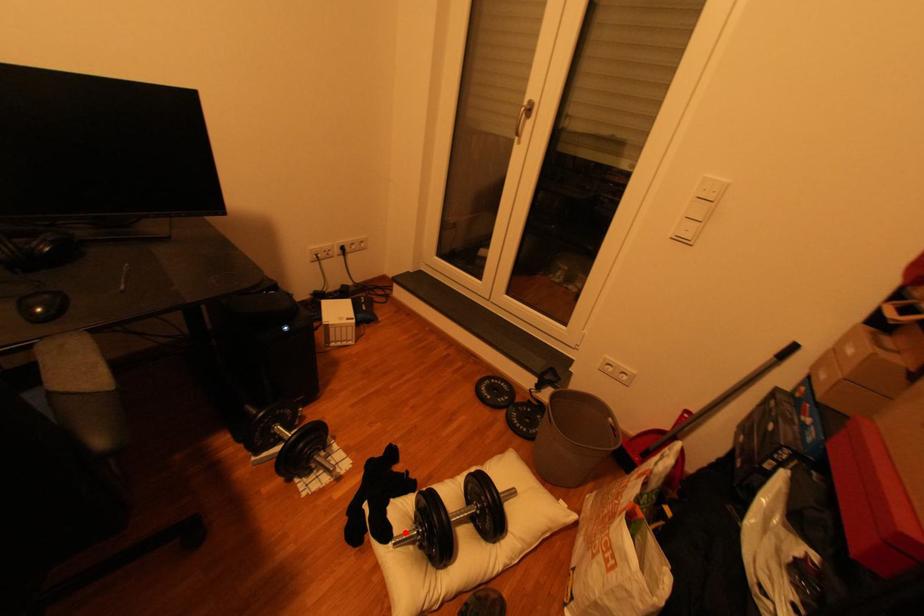
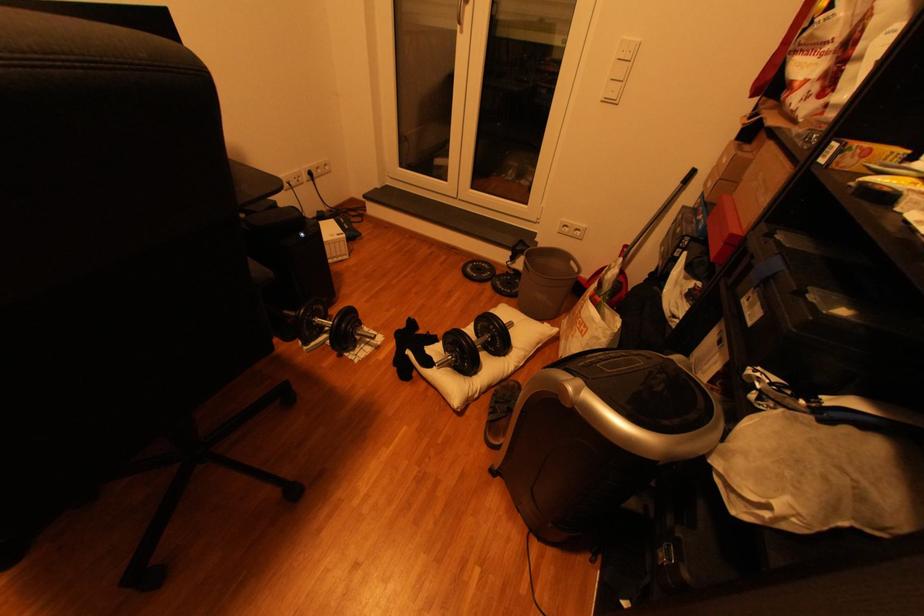
Locate, in the second image, the point that corresponds to the highlighted location in the first image.

(445, 361)